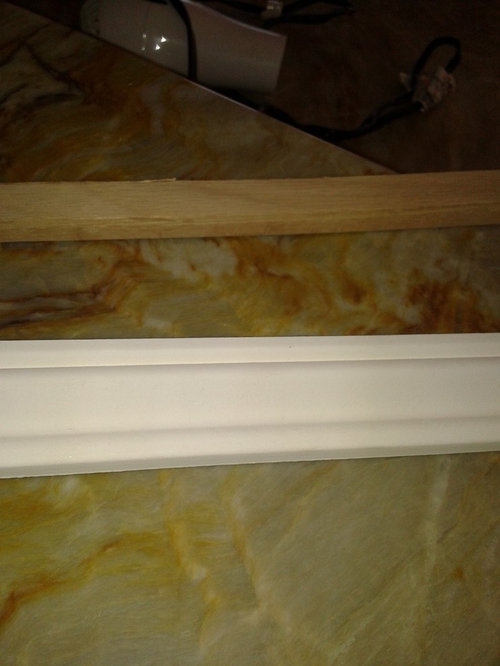
At what (x,y) coordinates should I click in order to perform the action: click on edge of cornice. Please return your answer as a coordinate pair (x, y). The width and height of the screenshot is (500, 666). Looking at the image, I should click on (323, 334).